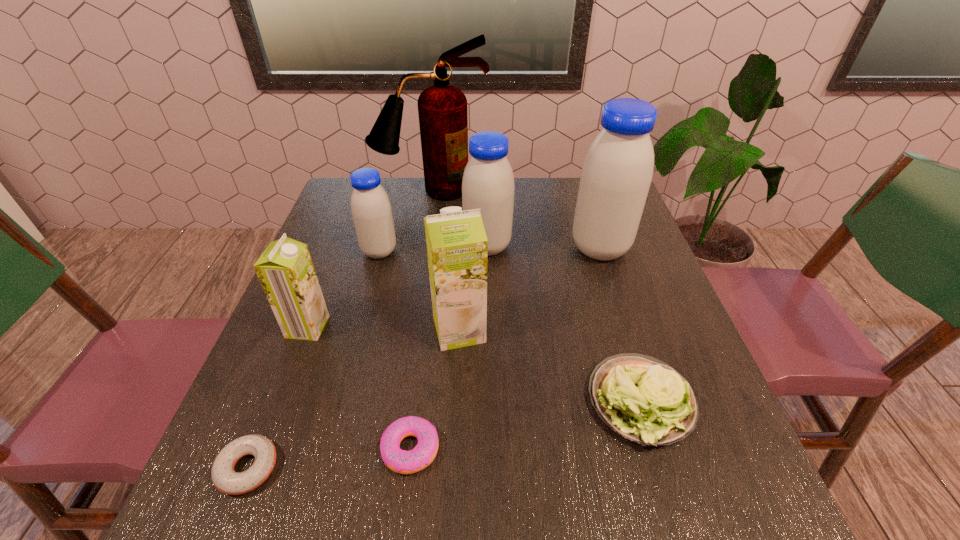
Find the location of a particular element. This screenshot has height=540, width=960. free space located 0.340m on the back of the green lettuce is located at coordinates (595, 253).

Where is `vacant region located 0.160m on the right of the right doughnut`? The width and height of the screenshot is (960, 540). vacant region located 0.160m on the right of the right doughnut is located at coordinates (534, 449).

Locate an element on the screen. Image resolution: width=960 pixels, height=540 pixels. vacant space situated 0.160m on the back of the left doughnut is located at coordinates (289, 364).

Where is `object located at the far edge`? This screenshot has height=540, width=960. object located at the far edge is located at coordinates (442, 108).

The width and height of the screenshot is (960, 540). Find the location of `fire extinguisher positioned at the left edge`. fire extinguisher positioned at the left edge is located at coordinates (442, 108).

Locate an element on the screen. doughnut that is at the left edge is located at coordinates (225, 479).

Locate an element on the screen. The width and height of the screenshot is (960, 540). soya milk that is at the right edge is located at coordinates (616, 175).

This screenshot has width=960, height=540. I want to click on lettuce that is at the right edge, so click(x=641, y=398).

Where is `object present at the far left corner`? object present at the far left corner is located at coordinates (442, 108).

Image resolution: width=960 pixels, height=540 pixels. I want to click on object that is at the near left corner, so click(x=225, y=479).